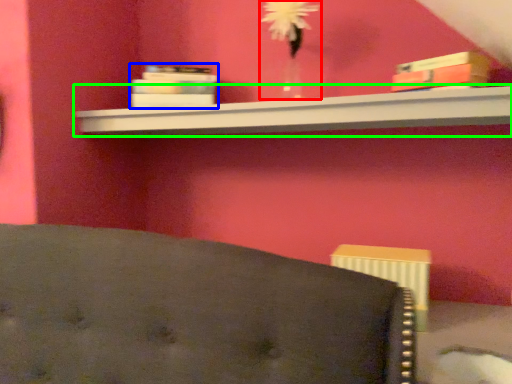
Question: Considering the real-world distances, which object is closest to floral arrangement (highlighted by a red box)? book (highlighted by a blue box) or shelf (highlighted by a green box).

Choices:
 (A) book
 (B) shelf

Answer: (B)